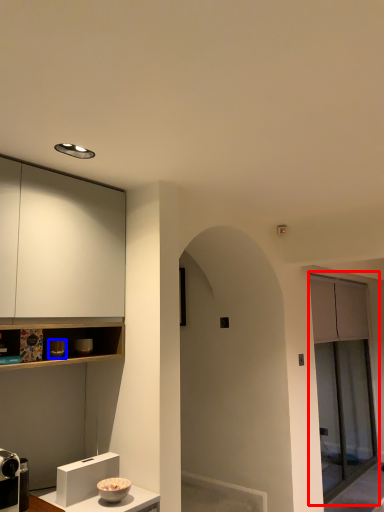
Question: Which object is closer to the camera taking this photo, screen door (highlighted by a red box) or appliance (highlighted by a blue box)?

Choices:
 (A) screen door
 (B) appliance

Answer: (B)